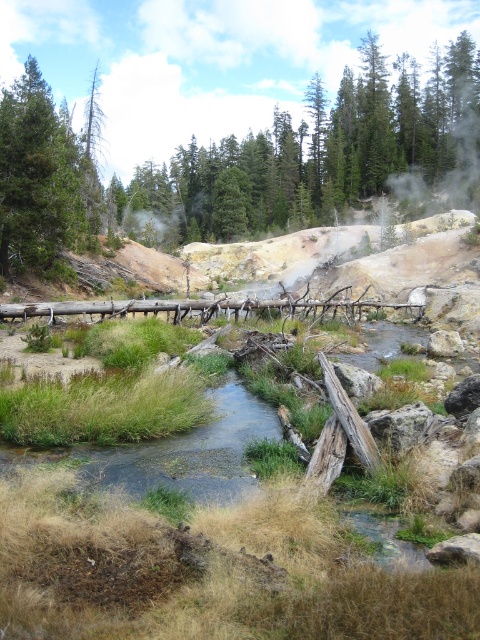
Is green coniferous trees at upper center to the right of green matte tree at upper left from the viewer's perspective?

Yes, green coniferous trees at upper center is to the right of green matte tree at upper left.

From the picture: Can you confirm if green coniferous trees at upper center is wider than green matte tree at upper left?

Indeed, green coniferous trees at upper center has a greater width compared to green matte tree at upper left.

Does point (371, 92) come farther from viewer compared to point (11, 170)?

Yes.

Identify the location of green coniferous trees at upper center. tap(322, 150).